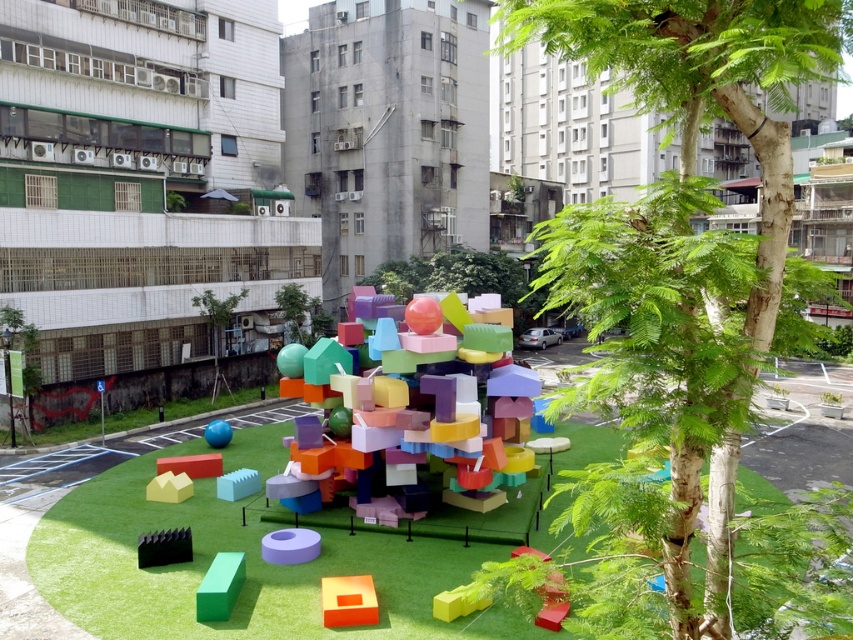
Question: Does green leafy tree at center appear on the right side of matte plastic colorful blocks at center?

Choices:
 (A) yes
 (B) no

Answer: (A)

Question: Which point is farther to the camera?

Choices:
 (A) green matte block at lower left
 (B) matte plastic colorful blocks at center
 (C) orange matte cube at lower center

Answer: (B)

Question: Considering the real-world distances, which object is farthest from the matte plastic colorful blocks at center?

Choices:
 (A) orange matte cube at lower center
 (B) green matte grass at center
 (C) green matte block at lower left

Answer: (B)

Question: Can you confirm if matte purple ring at lower center is positioned above glossy plastic ball at center?

Choices:
 (A) no
 (B) yes

Answer: (A)

Question: Estimate the real-world distances between objects in this image. Which object is closer to the green leafy tree at center?

Choices:
 (A) matte plastic colorful blocks at center
 (B) orange matte cube at lower center
 (C) matte yellow toy at lower left

Answer: (B)

Question: Does green matte grass at center lie behind glossy plastic ball at center?

Choices:
 (A) yes
 (B) no

Answer: (B)